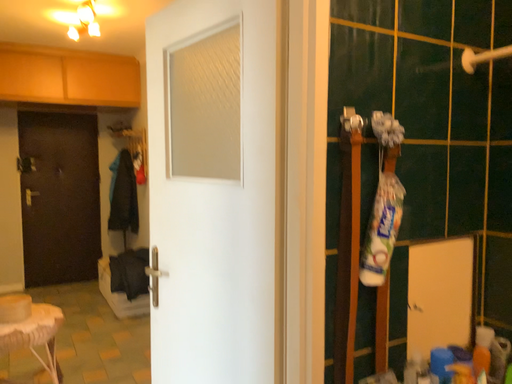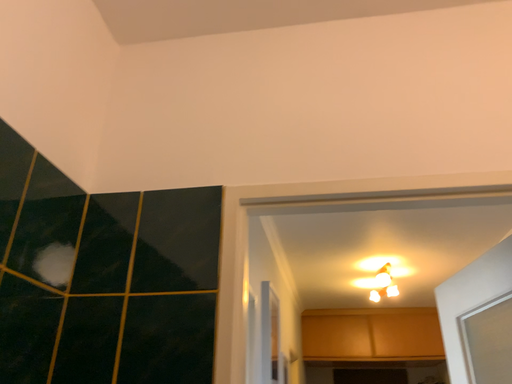
Question: How did the camera likely rotate when shooting the video?

Choices:
 (A) rotated upward
 (B) rotated downward

Answer: (A)